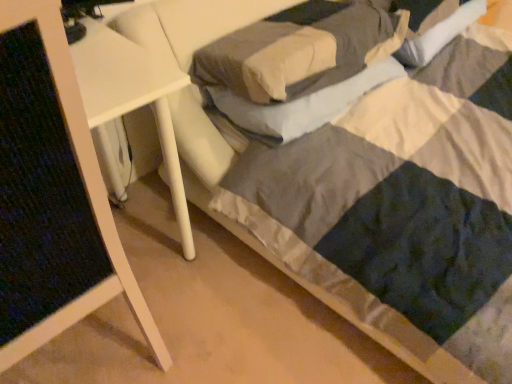
Question: Considering the positions of soft gray pillow at center, arranged as the 1th pillow when viewed from the top, and white glossy side table at upper left in the image, is soft gray pillow at center, arranged as the 1th pillow when viewed from the top, wider or thinner than white glossy side table at upper left?

Choices:
 (A) wide
 (B) thin

Answer: (B)

Question: In the image, is soft gray pillow at center, arranged as the 1th pillow when viewed from the top, on the left side or the right side of white glossy side table at upper left?

Choices:
 (A) right
 (B) left

Answer: (A)

Question: Which of these objects is positioned closest to the soft white pillow at center, the 2th pillow in the top-to-bottom sequence?

Choices:
 (A) white glossy side table at upper left
 (B) soft gray pillow at center, arranged as the 1th pillow when viewed from the top

Answer: (B)

Question: Estimate the real-world distances between objects in this image. Which object is closer to the soft white pillow at center, the 1th pillow positioned from the bottom?

Choices:
 (A) white glossy side table at upper left
 (B) soft gray pillow at center, acting as the 2th pillow starting from the bottom

Answer: (B)